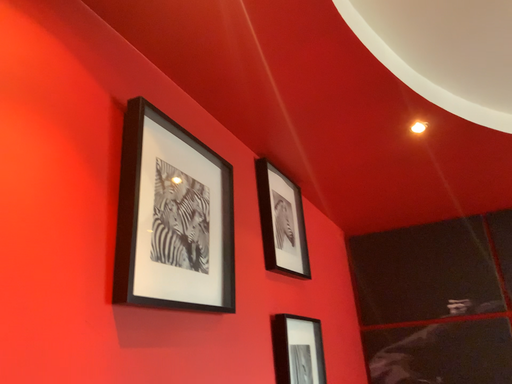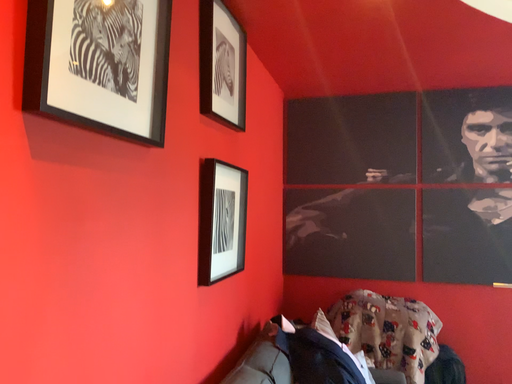
Question: Which way did the camera rotate in the video?

Choices:
 (A) rotated upward
 (B) rotated downward

Answer: (B)